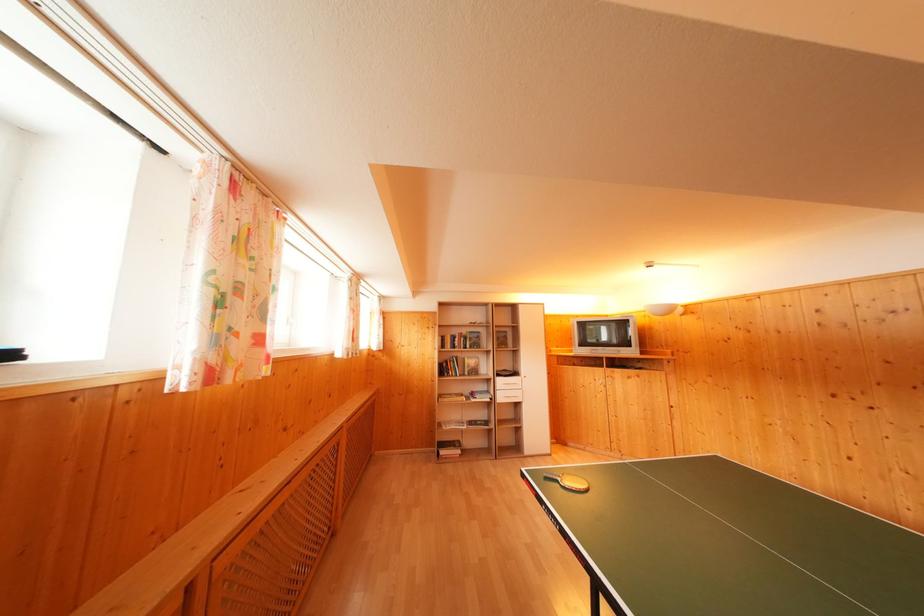
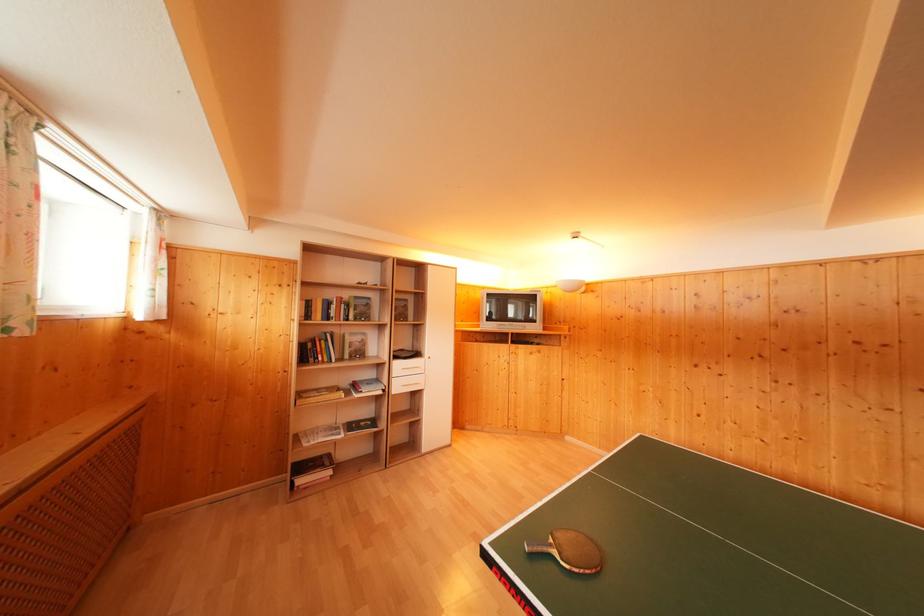
Locate, in the second image, the point that corresponds to [521,411] in the first image.

(420, 400)